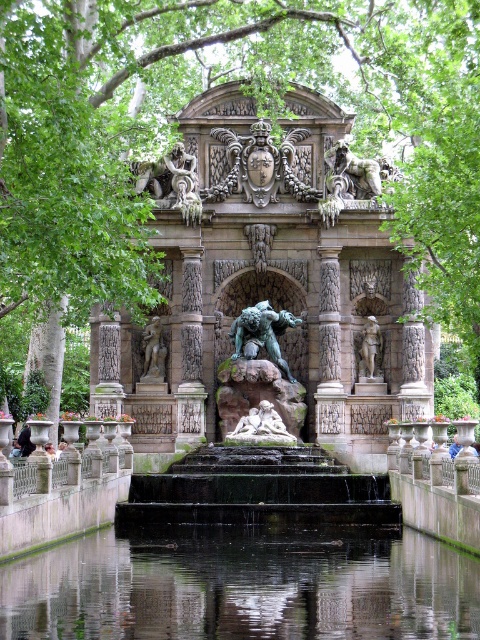
Question: Does green leafy tree at upper center have a smaller size compared to white marble reclining couple at center?

Choices:
 (A) yes
 (B) no

Answer: (B)

Question: Which is nearer to the green patina stone statue at center?

Choices:
 (A) transparent liquid water at center
 (B) polished bronze statue at center
 (C) bronze statue at center
 (D) green leafy tree at upper center

Answer: (B)

Question: Does polished bronze statue at center appear over bronze statue at center?

Choices:
 (A) yes
 (B) no

Answer: (A)

Question: Among these objects, which one is nearest to the camera?

Choices:
 (A) white marble reclining couple at center
 (B) polished bronze statue at center
 (C) green leafy tree at upper center
 (D) green patina stone statue at center

Answer: (C)

Question: Which point is farther to the camera?

Choices:
 (A) (363, 353)
 (B) (345, 248)

Answer: (A)

Question: Is polished bronze statue at center to the left of bronze statue at center from the viewer's perspective?

Choices:
 (A) yes
 (B) no

Answer: (B)